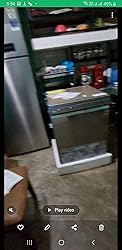
The image size is (122, 250). Identify the location of wall. (55, 56).